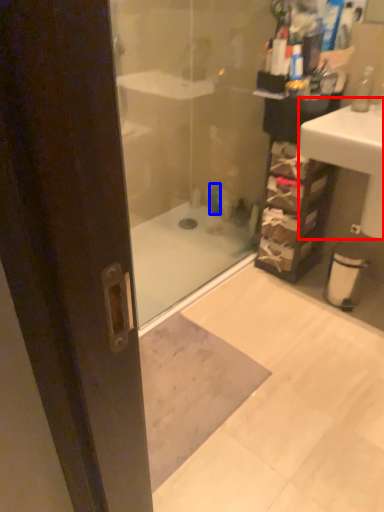
Question: Which of the following is the farthest to the observer, sink (highlighted by a red box) or toiletry (highlighted by a blue box)?

Choices:
 (A) sink
 (B) toiletry

Answer: (B)